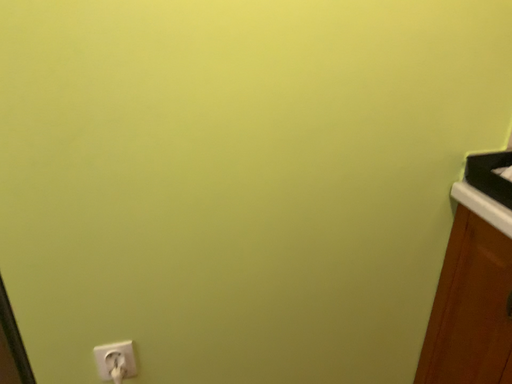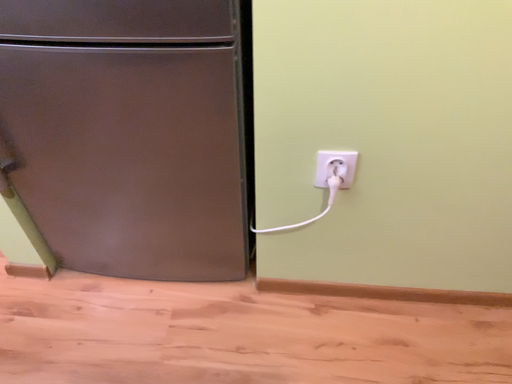
Question: Which way did the camera rotate in the video?

Choices:
 (A) rotated upward
 (B) rotated downward

Answer: (B)